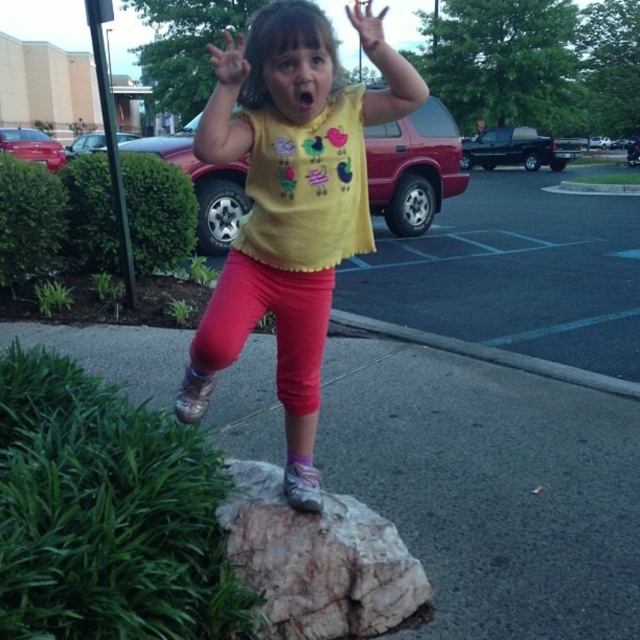
You are standing in the parking lot and see two points marked in the image. Which point is closer to you, point (x=36, y=326) or point (x=305, y=314)?

Point (x=36, y=326) is closer to you because it is further to the viewer than point (x=305, y=314).

You are a delivery person who needs to place a small package on the ground near the gray asphalt pavement at center and the matte yellow shirt at center. Which object should you choose to place the package on to ensure it stays visible and doesn not get dirty?

The matte yellow shirt at center is smaller than the gray asphalt pavement at center, so placing the package on the matte yellow shirt at center ensures it stays visible and doesn not get dirty compared to the larger pavement.

You are a drone operator trying to capture the best aerial shot of the scene. The gray asphalt pavement at center and the matte yellow shirt at center are both in your camera frame. Which object will appear closer to the bottom of the frame?

The gray asphalt pavement at center has a lesser height compared to the matte yellow shirt at center, so the gray asphalt pavement at center will appear closer to the bottom of the frame.